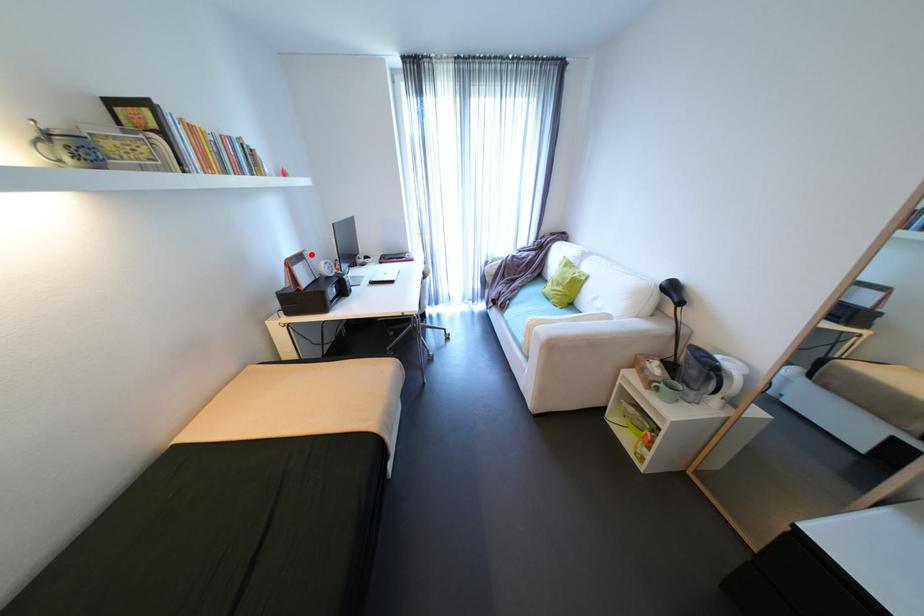
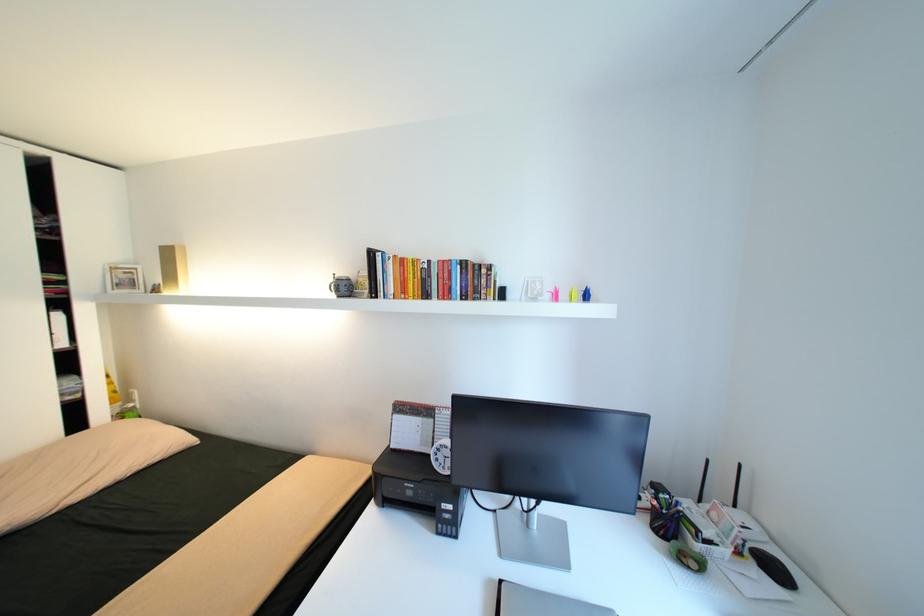
Question: A red point is marked in image1. In image2, is the corresponding 3D point closer to the camera or farther? Reply with the corresponding letter.

Choices:
 (A) The corresponding 3D point is closer.
 (B) The corresponding 3D point is farther.

Answer: (B)